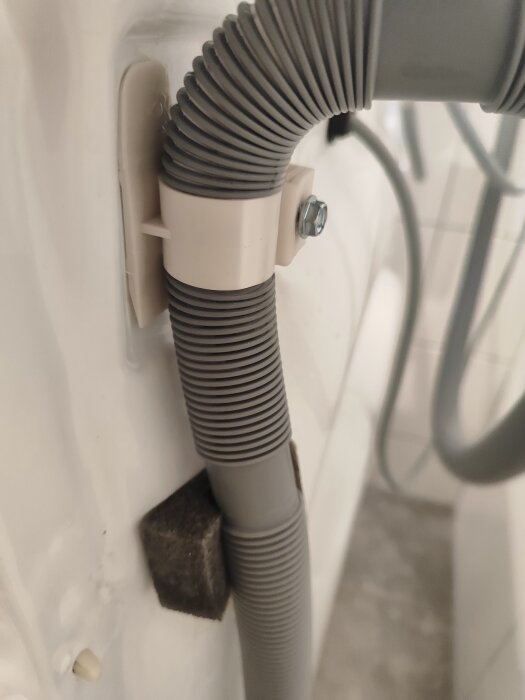
Image resolution: width=525 pixels, height=700 pixels. I want to click on tile, so click(x=319, y=446).